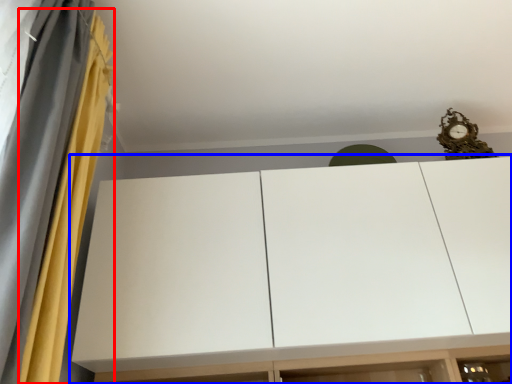
Question: Which object is further to the camera taking this photo, curtain (highlighted by a red box) or cupboard (highlighted by a blue box)?

Choices:
 (A) curtain
 (B) cupboard

Answer: (B)